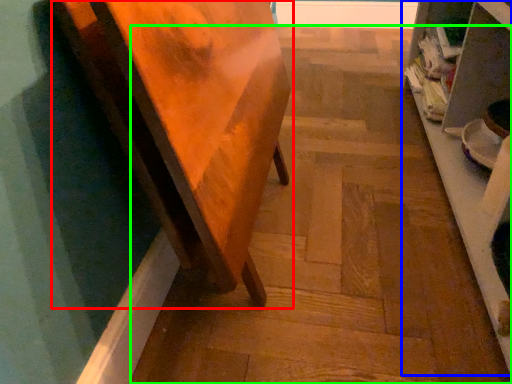
Question: Which object is the farthest from furniture (highlighted by a red box)? Choose among these: shelf (highlighted by a blue box) or stair (highlighted by a green box).

Choices:
 (A) shelf
 (B) stair

Answer: (A)